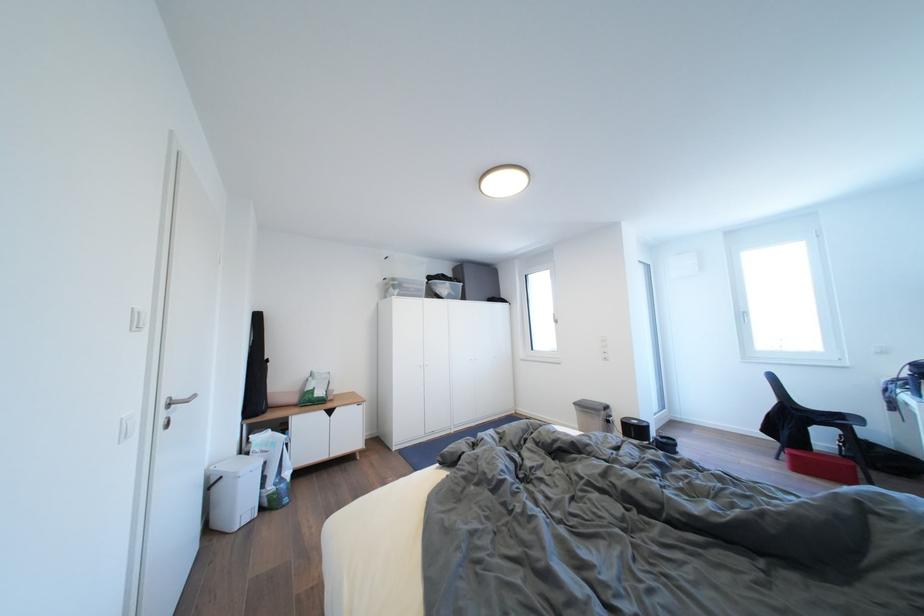
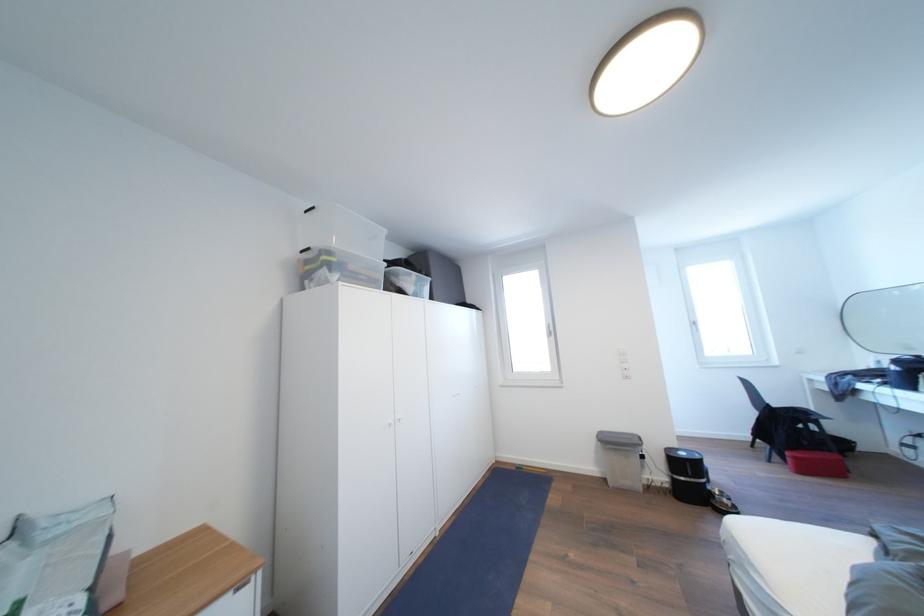
Find the pixel in the second image that matches [799,460] in the first image.

(803, 463)